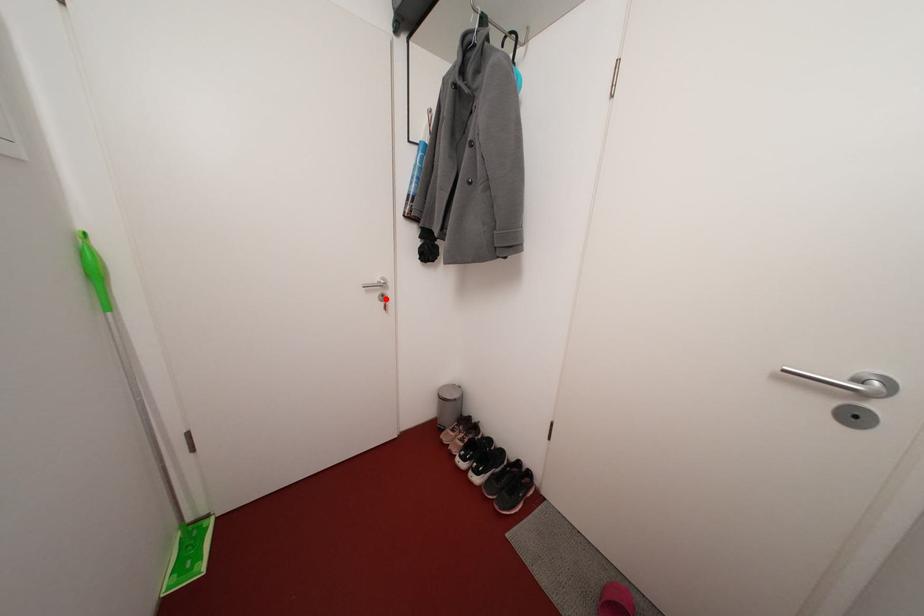
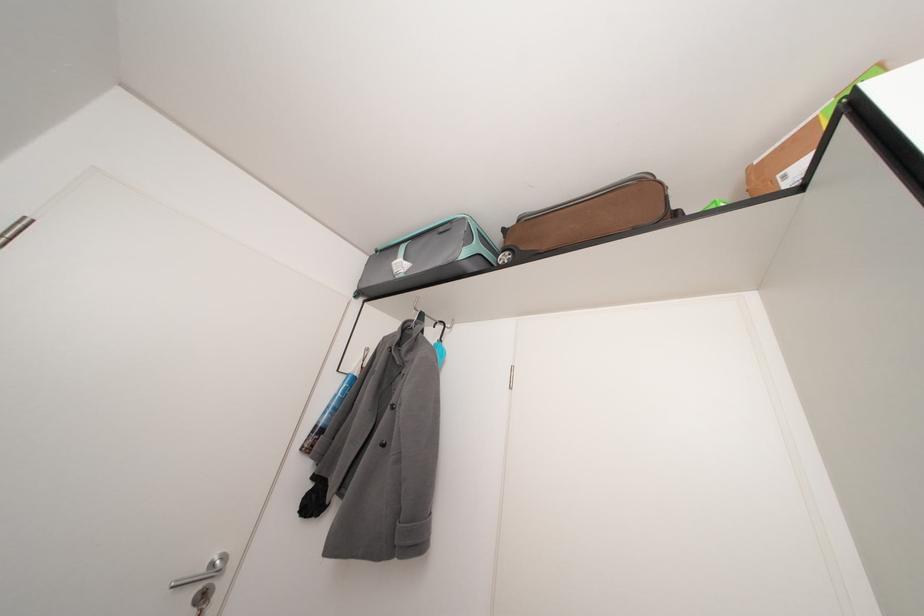
Find the pixel in the second image that matches the highlighted location in the first image.

(208, 592)